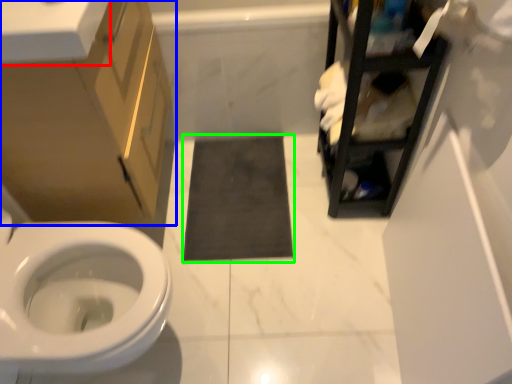
Question: Which object is the farthest from counter top (highlighted by a red box)? Choose among these: bathroom cabinet (highlighted by a blue box) or bath mat (highlighted by a green box).

Choices:
 (A) bathroom cabinet
 (B) bath mat

Answer: (B)